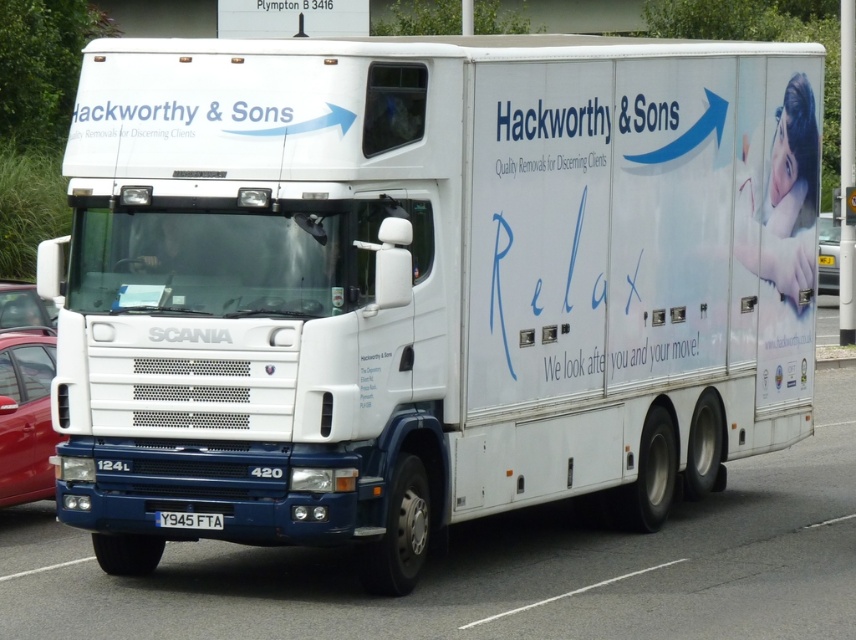
Question: Is metallic silver car at right thinner than white plastic license plate at center?

Choices:
 (A) no
 (B) yes

Answer: (A)

Question: Does metallic silver car at left appear under white plastic license plate at center?

Choices:
 (A) yes
 (B) no

Answer: (B)

Question: Which of these objects is positioned closest to the metallic silver car at left?

Choices:
 (A) white glossy truck at center
 (B) white plastic license plate at center

Answer: (A)

Question: Does metallic silver car at left appear under white plastic license plate at center?

Choices:
 (A) yes
 (B) no

Answer: (B)

Question: Estimate the real-world distances between objects in this image. Which object is closer to the white glossy truck at center?

Choices:
 (A) metallic red car at left
 (B) metallic silver car at left
 (C) metallic silver car at right
 (D) white plastic license plate at center

Answer: (D)

Question: Which object is closer to the camera taking this photo?

Choices:
 (A) white plastic license plate at center
 (B) metallic red car at left
 (C) metallic silver car at left
 (D) white glossy truck at center

Answer: (D)